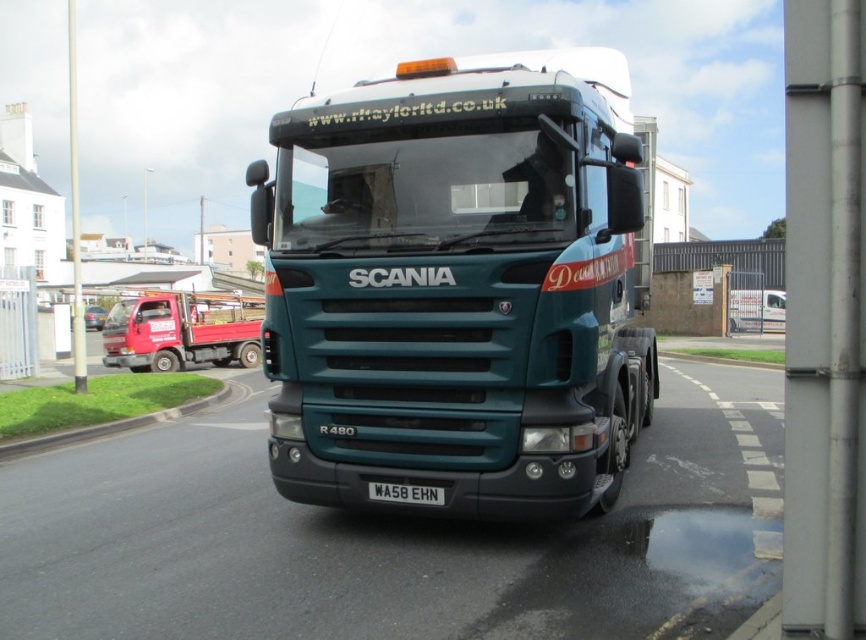
Question: Which is nearer to the matte red truck at left?

Choices:
 (A) teal matte truck at center
 (B) black metal license plate at center

Answer: (A)

Question: Does matte red truck at left have a lesser width compared to black metal license plate at center?

Choices:
 (A) no
 (B) yes

Answer: (A)

Question: Which point is farther to the camera?

Choices:
 (A) (612, 493)
 (B) (170, 355)
 (C) (434, 486)

Answer: (B)

Question: Which point appears farthest from the camera in this image?

Choices:
 (A) (241, 355)
 (B) (385, 496)
 (C) (324, 173)

Answer: (A)

Question: Is teal matte truck at center below matte red truck at left?

Choices:
 (A) yes
 (B) no

Answer: (B)

Question: Is matte red truck at left to the right of black metal license plate at center from the viewer's perspective?

Choices:
 (A) yes
 (B) no

Answer: (B)